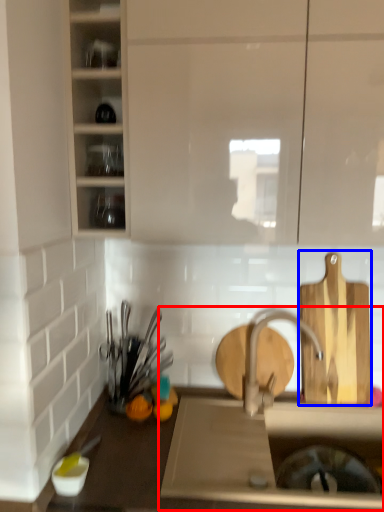
Question: Among these objects, which one is nearest to the camera, sink (highlighted by a red box) or cutting board (highlighted by a blue box)?

Choices:
 (A) sink
 (B) cutting board

Answer: (A)